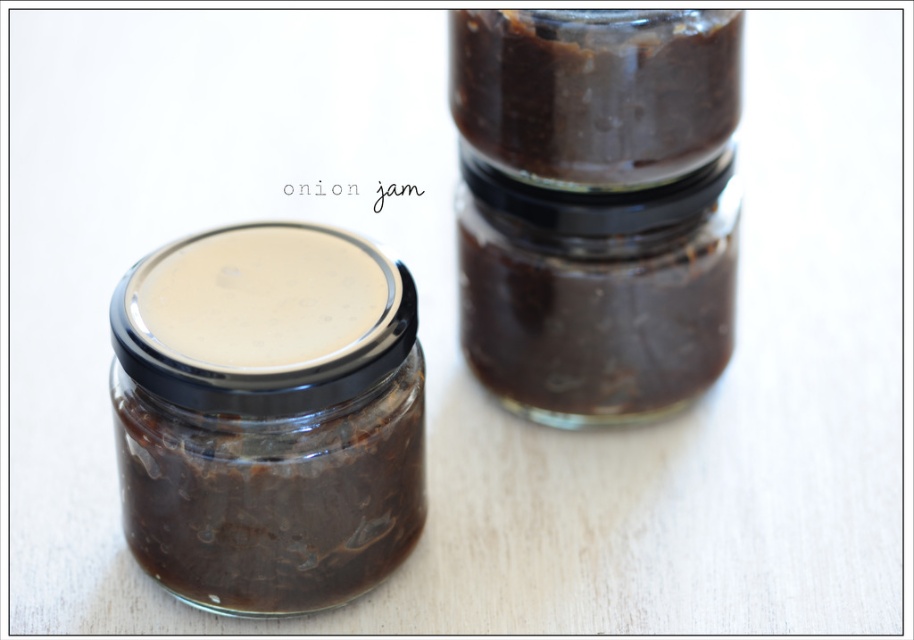
From the picture: You are a chef preparing a dish that requires a specific amount of onion jam. You have two jars available in the image. Which jar, the dark brown glass jar at center or the matte glass jar at left, has a larger capacity to hold more onion jam?

The dark brown glass jar at center has a larger size compared to the matte glass jar at left, so it can hold more onion jam.

You are organizing a pantry and need to place the matte glass jar at left and the dark brown glass jar at upper center on a shelf. Which jar should you place closer to the front of the shelf to match the image?

You should place the matte glass jar at left closer to the front of the shelf because in the image, the matte glass jar at left is in front of the dark brown glass jar at upper center.

You are a chef standing at a counter and want to reach the dark brown glass jar at center to take some onion jam. If your arm can extend 0.9 meters, can you reach it?

The dark brown glass jar at center is 1.06 meters away from the camera. Since your arm can only extend 0.9 meters, you cannot reach it without moving closer.